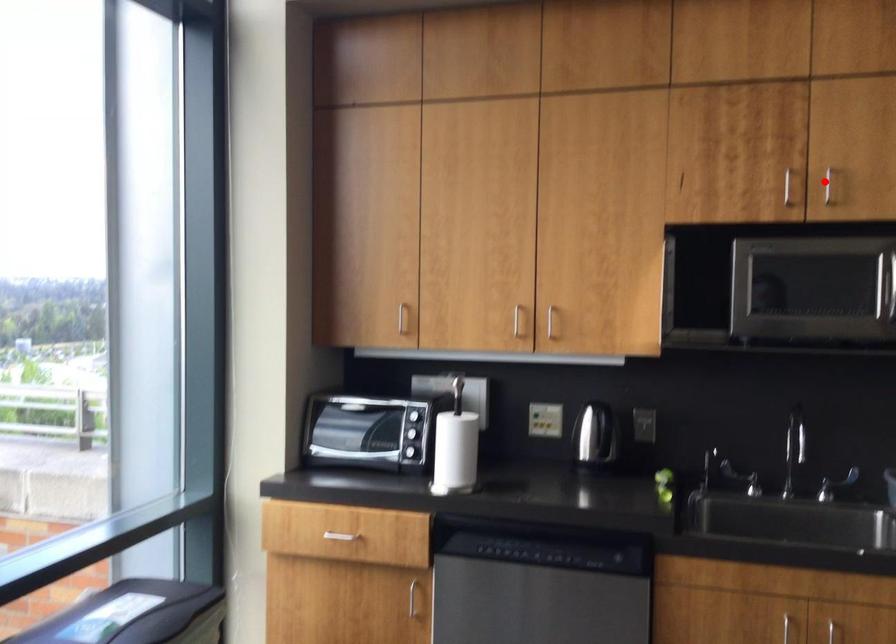
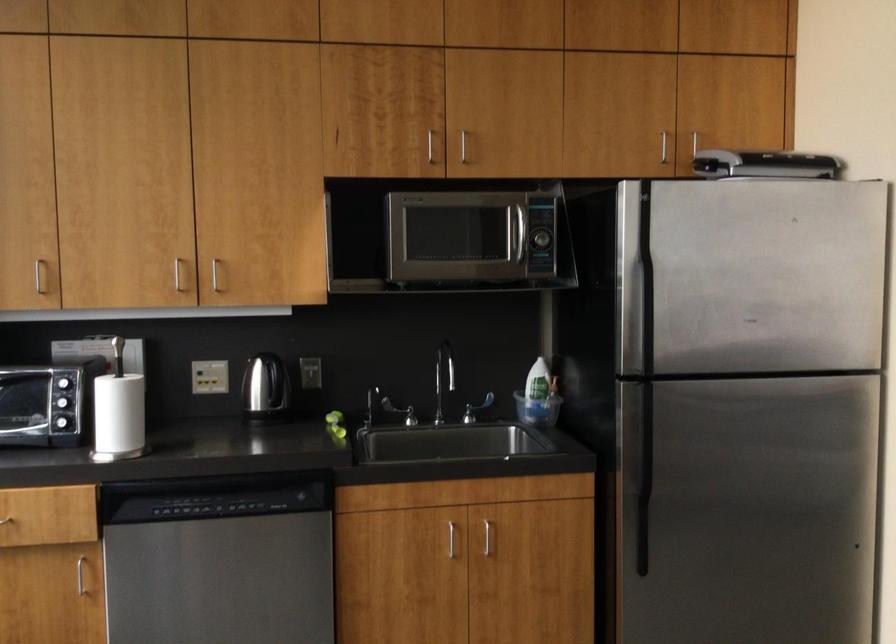
Question: A red point is marked in image1. In image2, is the corresponding 3D point closer to the camera or farther? Reply with the corresponding letter.

Choices:
 (A) The corresponding 3D point is closer.
 (B) The corresponding 3D point is farther.

Answer: (B)